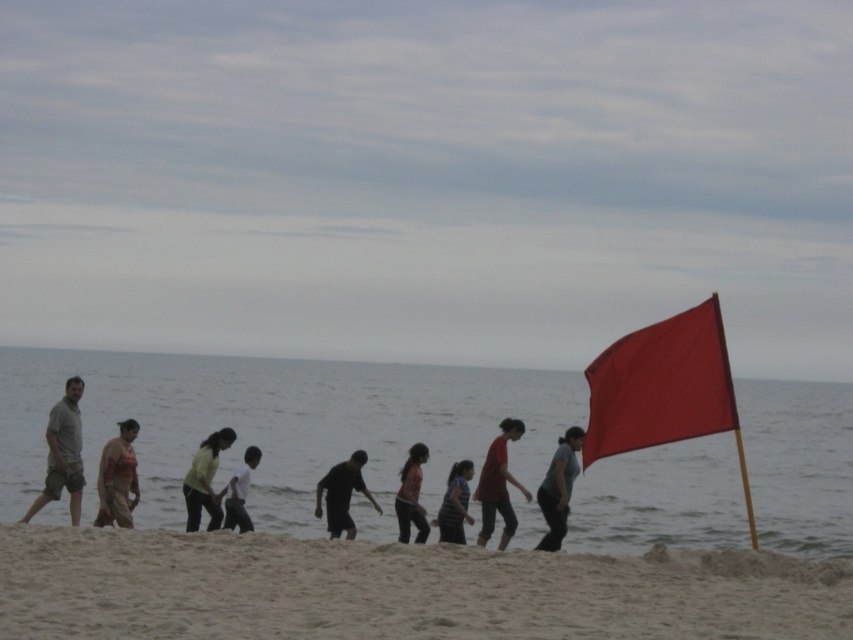
Question: Can you confirm if smooth matte red flag at right is positioned above light green fabric shirt at center?

Choices:
 (A) yes
 (B) no

Answer: (A)

Question: Is camouflage fabric shirt at left positioned before light green fabric shirt at center?

Choices:
 (A) no
 (B) yes

Answer: (B)

Question: Considering the real-world distances, which object is closest to the matte khaki shorts at left?

Choices:
 (A) black matte shirt at center
 (B) striped fabric shirt at center
 (C) camouflage fabric shirt at left
 (D) sandy beach at lower center

Answer: (C)

Question: Does smooth matte red flag at right come behind dark gray fabric pants at center?

Choices:
 (A) no
 (B) yes

Answer: (A)

Question: Estimate the real-world distances between objects in this image. Which object is farther from the black matte shirt at center?

Choices:
 (A) matte khaki shorts at left
 (B) matte red shirt at center

Answer: (A)

Question: Which point is farther to the camera?

Choices:
 (A) coord(505,458)
 (B) coord(97,496)

Answer: (A)